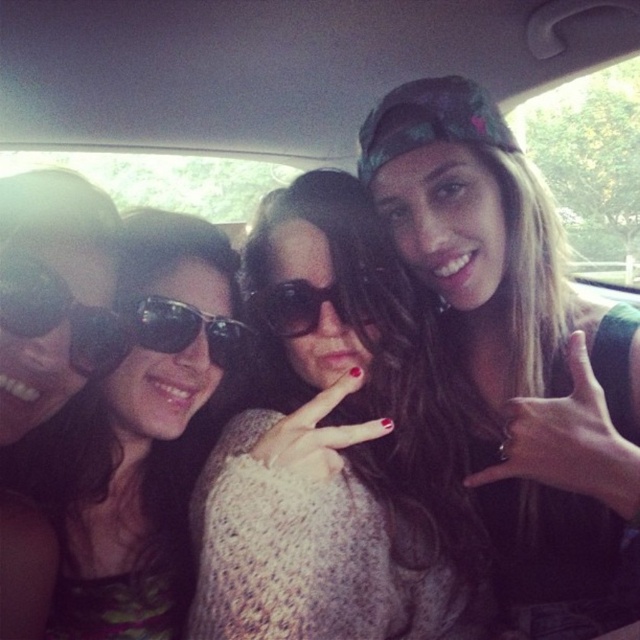
You are a fashion designer observing the car scene. You need to determine which item is bigger between the knitted sweater at center and the matte black sunglasses at left. Can you tell me which one is larger?

The knitted sweater at center is larger in size than the matte black sunglasses at left, so the knitted sweater at center is bigger.

You are a passenger in the car and want to hand a snack to the person wearing the matte black sunglasses at left. The snack is currently on the knitted sweater at center. Can you reach it without moving the sweater?

The knitted sweater at center is located above the matte black sunglasses at left, so you can reach the snack by moving your hand under the sweater.

You are a photographer trying to capture a clear shot of the matte black cap at upper right and the matte black sunglasses at left. Since the cap is taller than the sunglasses, which object might partially block the view of the other when taking the photo?

The matte black cap at upper right is much taller as the matte black sunglasses at left, so the cap could partially block the view of the sunglasses.